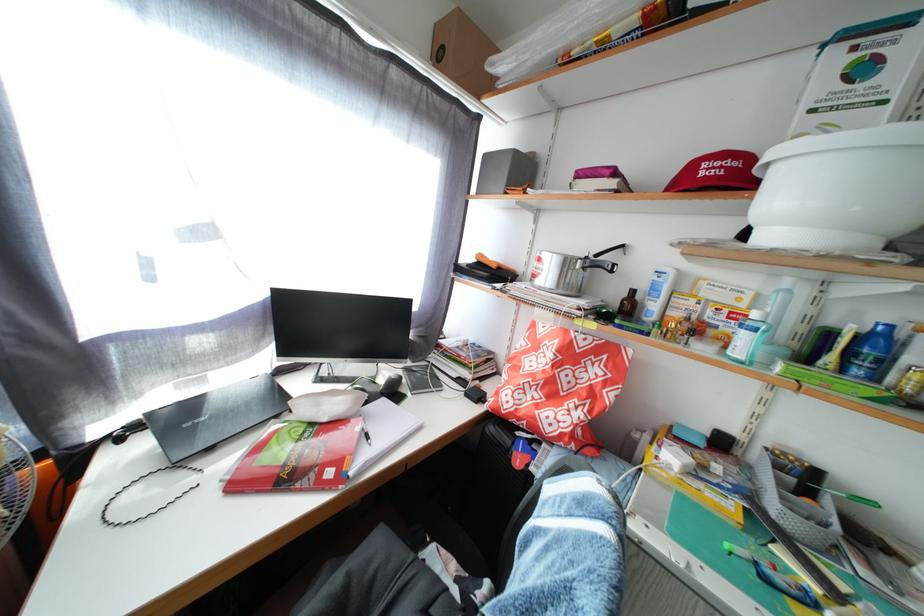
Find the location of a particular element. The image size is (924, 616). white bottle pump is located at coordinates (785, 284).